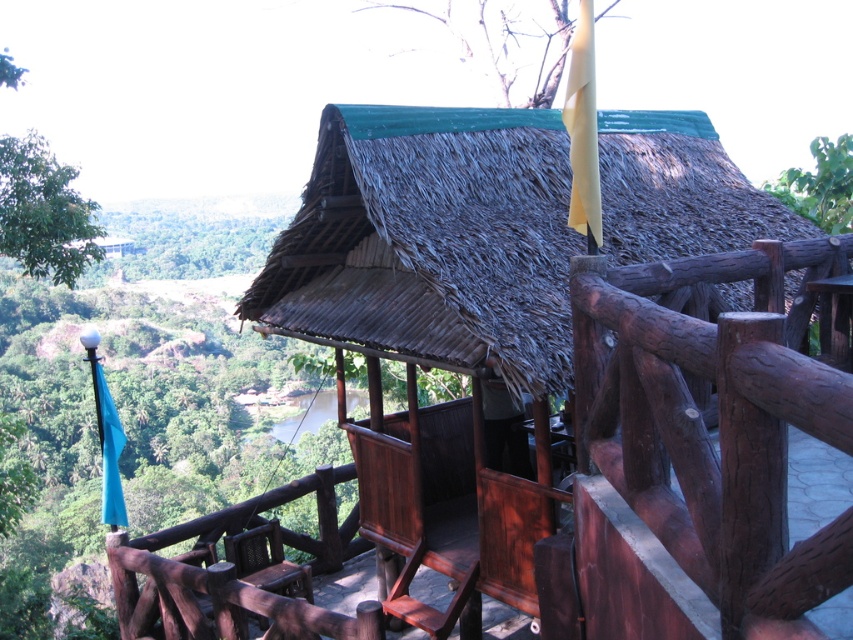
You are a painter standing on the ground near the green thatch roof at center and the green leafy tree at upper right. You want to paint both objects. Which object will require a wider brush stroke to cover its entire width?

The green leafy tree at upper right requires a wider brush stroke because its width is greater than the green thatch roof at center.

In the scene shown: Based on the scene description, what object is located at the coordinates point (44,212)?

The point (44,212) corresponds to the green leafy tree at upper left.